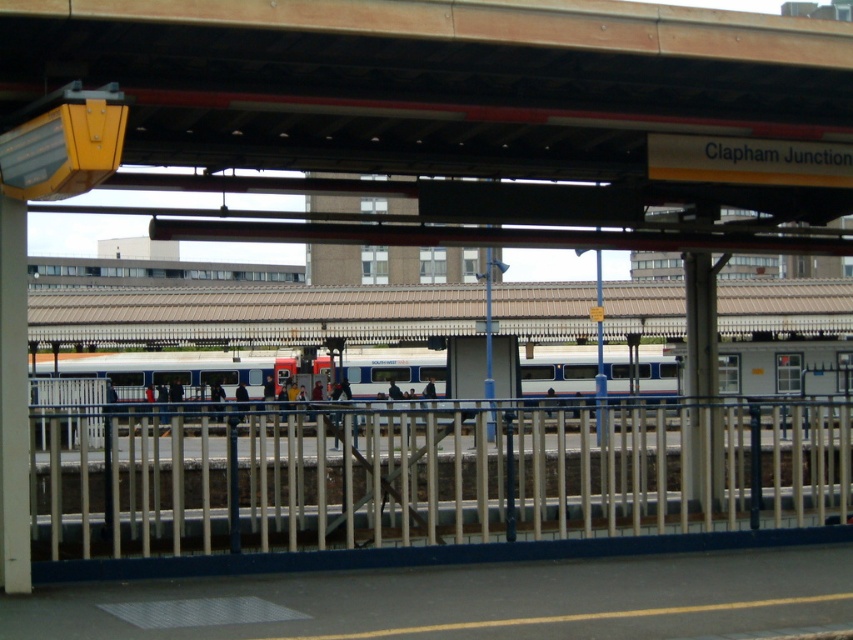
Question: Which point is closer to the camera taking this photo?

Choices:
 (A) [x=787, y=476]
 (B) [x=601, y=124]

Answer: (B)

Question: Can you confirm if wooden beam at upper center is positioned above metallic silver rail at center?

Choices:
 (A) no
 (B) yes

Answer: (B)

Question: Is wooden beam at upper center to the right of metallic silver rail at center from the viewer's perspective?

Choices:
 (A) no
 (B) yes

Answer: (B)

Question: Which object appears farthest from the camera in this image?

Choices:
 (A) wooden beam at upper center
 (B) metallic silver rail at center

Answer: (A)

Question: Which object appears farthest from the camera in this image?

Choices:
 (A) wooden beam at upper center
 (B) metallic silver rail at center

Answer: (A)

Question: Is wooden beam at upper center to the left of metallic silver rail at center from the viewer's perspective?

Choices:
 (A) no
 (B) yes

Answer: (A)